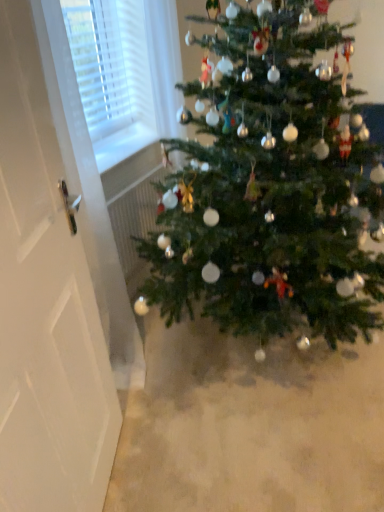
Question: Looking at the image, does green matte christmas tree at center seem bigger or smaller compared to white glossy door at left?

Choices:
 (A) small
 (B) big

Answer: (B)

Question: Considering the positions of green matte christmas tree at center and white glossy door at left in the image, is green matte christmas tree at center wider or thinner than white glossy door at left?

Choices:
 (A) thin
 (B) wide

Answer: (B)

Question: From their relative heights in the image, would you say green matte christmas tree at center is taller or shorter than white glossy door at left?

Choices:
 (A) short
 (B) tall

Answer: (A)

Question: Considering the positions of point tap(28, 369) and point tap(210, 188), is point tap(28, 369) closer or farther from the camera than point tap(210, 188)?

Choices:
 (A) farther
 (B) closer

Answer: (B)

Question: In terms of size, does white glossy door at left appear bigger or smaller than green matte christmas tree at center?

Choices:
 (A) big
 (B) small

Answer: (B)

Question: Based on their positions, is white glossy door at left located to the left or right of green matte christmas tree at center?

Choices:
 (A) left
 (B) right

Answer: (A)

Question: Choose the correct answer: Is white glossy door at left inside green matte christmas tree at center or outside it?

Choices:
 (A) outside
 (B) inside

Answer: (A)